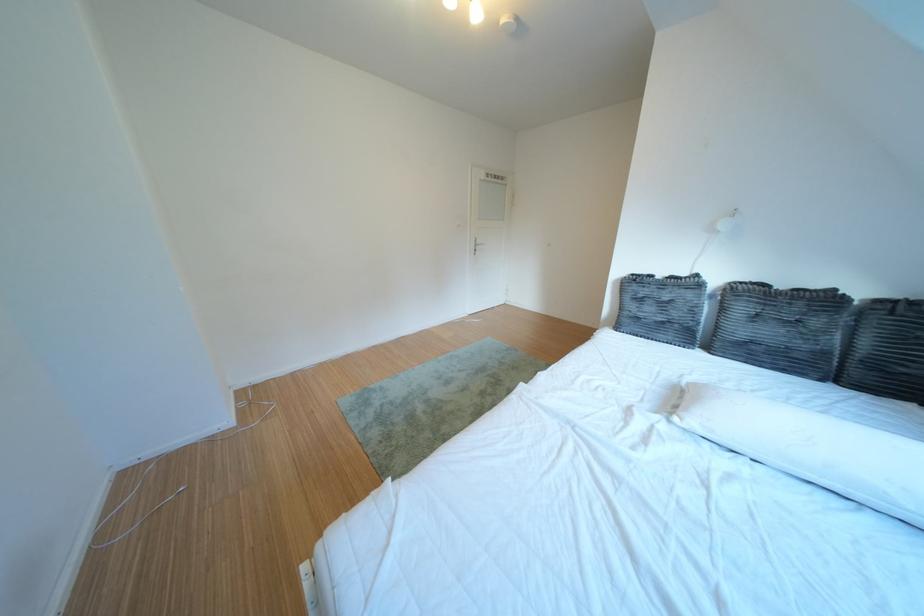
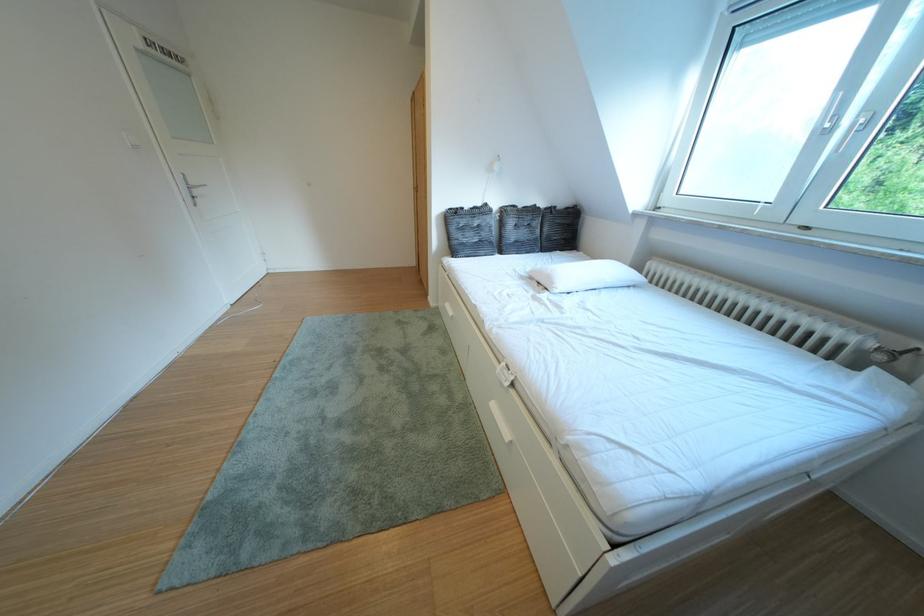
Find the pixel in the second image that matches pixel 639 318 in the first image.

(468, 246)